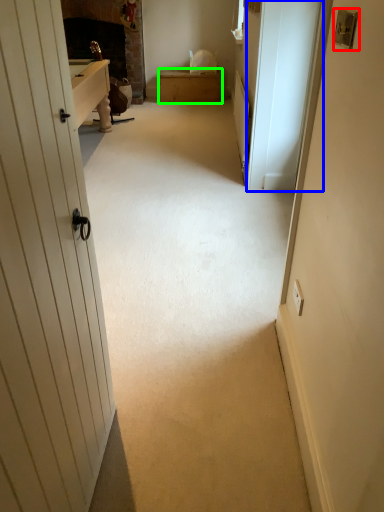
Question: Estimate the real-world distances between objects in this image. Which object is closer to lock (highlighted by a red box), screen door (highlighted by a blue box) or furniture (highlighted by a green box)?

Choices:
 (A) screen door
 (B) furniture

Answer: (A)